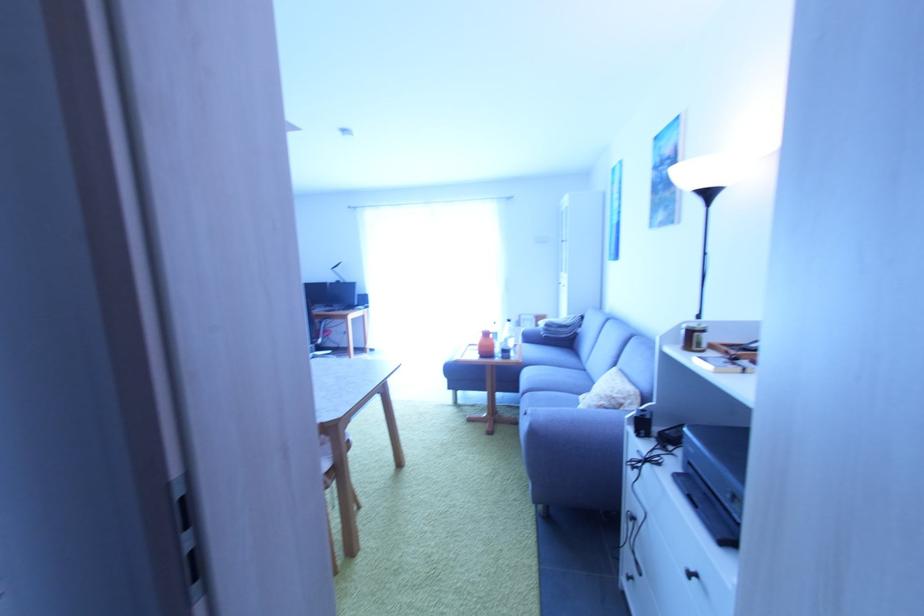
Where would you lift the wooden tray? Please return your answer as a coordinate pair (x, y).

(736, 350)